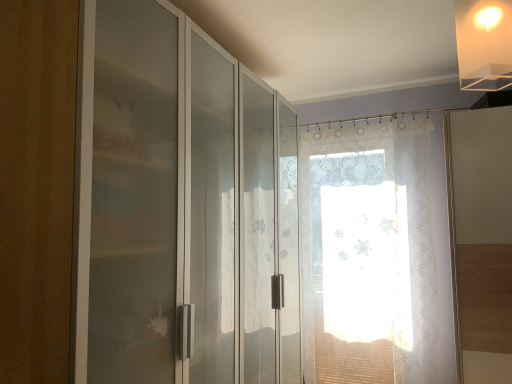
Where is `translucent floral curtain at center`? Image resolution: width=512 pixels, height=384 pixels. translucent floral curtain at center is located at coordinates (374, 254).

Locate an element on the screen. Image resolution: width=512 pixels, height=384 pixels. translucent acrylic lampshade at upper right is located at coordinates (484, 44).

The height and width of the screenshot is (384, 512). Describe the element at coordinates (484, 44) in the screenshot. I see `translucent acrylic lampshade at upper right` at that location.

Image resolution: width=512 pixels, height=384 pixels. Describe the element at coordinates (188, 209) in the screenshot. I see `frosted glass cabinet at left` at that location.

Where is `translucent floral curtain at center`? This screenshot has width=512, height=384. translucent floral curtain at center is located at coordinates (374, 254).

From a real-world perspective, is translucent acrylic lampshade at upper right on top of frosted glass cabinet at left?

Yes, from a real-world perspective, translucent acrylic lampshade at upper right is over frosted glass cabinet at left

Are translucent acrylic lampshade at upper right and frosted glass cabinet at left beside each other?

translucent acrylic lampshade at upper right is not next to frosted glass cabinet at left, and they're not touching.

Is frosted glass cabinet at left at the back of translucent acrylic lampshade at upper right?

No, translucent acrylic lampshade at upper right's orientation is not away from frosted glass cabinet at left.

Identify the location of door lying on the left of translucent acrylic lampshade at upper right. (188, 209).

Between frosted glass cabinet at left and translucent acrylic lampshade at upper right, which one has less height?

translucent acrylic lampshade at upper right is shorter.

You are a GUI agent. You are given a task and a screenshot of the screen. Output one action in this format:
    pyautogui.click(x=<x>, y=<y>)
    Task: Click on the door that appears below the translucent acrylic lampshade at upper right (from the image's perspective)
    This screenshot has width=512, height=384.
    Given the screenshot: What is the action you would take?
    pyautogui.click(x=188, y=209)

Is translucent acrylic lampshade at upper right outside of translucent floral curtain at center?

Yes.

Considering the sizes of objects translucent acrylic lampshade at upper right and translucent floral curtain at center in the image provided, who is shorter, translucent acrylic lampshade at upper right or translucent floral curtain at center?

With less height is translucent acrylic lampshade at upper right.

In the image, is translucent acrylic lampshade at upper right on the left side or the right side of translucent floral curtain at center?

Based on their positions, translucent acrylic lampshade at upper right is located to the left of translucent floral curtain at center.

Is translucent acrylic lampshade at upper right positioned in front of translucent floral curtain at center?

That is True.

Can you confirm if translucent floral curtain at center is wider than translucent acrylic lampshade at upper right?

No.

Is translucent floral curtain at center next to translucent acrylic lampshade at upper right?

They are not placed beside each other.

Which point is more forward, (369, 347) or (480, 79)?

The point (480, 79) is closer.

Considering their positions, is translucent floral curtain at center located in front of or behind translucent acrylic lampshade at upper right?

Clearly, translucent floral curtain at center is behind translucent acrylic lampshade at upper right.

Considering the sizes of objects frosted glass cabinet at left and translucent floral curtain at center in the image provided, who is thinner, frosted glass cabinet at left or translucent floral curtain at center?

translucent floral curtain at center.

Which object is closer to the camera taking this photo, frosted glass cabinet at left or translucent floral curtain at center?

frosted glass cabinet at left is closer to the camera.

Is translucent floral curtain at center surrounded by frosted glass cabinet at left?

No, translucent floral curtain at center is not a part of frosted glass cabinet at left.

How different are the orientations of frosted glass cabinet at left and translucent floral curtain at center in degrees?

The angle between the facing direction of frosted glass cabinet at left and the facing direction of translucent floral curtain at center is 86.8 degrees.

How far apart are translucent floral curtain at center and frosted glass cabinet at left?

They are 1.26 meters apart.

Consider the image. Looking at the image, does translucent floral curtain at center seem bigger or smaller compared to frosted glass cabinet at left?

Clearly, translucent floral curtain at center is smaller in size than frosted glass cabinet at left.

Where is `window located on the right of frosted glass cabinet at left`? Image resolution: width=512 pixels, height=384 pixels. window located on the right of frosted glass cabinet at left is located at coordinates (374, 254).

Is translucent floral curtain at center not inside frosted glass cabinet at left?

A: That's correct, translucent floral curtain at center is outside of frosted glass cabinet at left.

This screenshot has width=512, height=384. Find the location of `light fixture located above the frosted glass cabinet at left (from the image's perspective)`. light fixture located above the frosted glass cabinet at left (from the image's perspective) is located at coordinates (484, 44).

I want to click on door that appears below the translucent acrylic lampshade at upper right (from the image's perspective), so click(188, 209).

Looking at this image, estimate the real-world distances between objects in this image. Which object is further from frosted glass cabinet at left, translucent acrylic lampshade at upper right or translucent floral curtain at center?

Among the two, translucent floral curtain at center is located further to frosted glass cabinet at left.

From the image, which object appears to be farther from frosted glass cabinet at left, translucent floral curtain at center or translucent acrylic lampshade at upper right?

translucent floral curtain at center.

When comparing their distances from translucent floral curtain at center, does frosted glass cabinet at left or translucent acrylic lampshade at upper right seem closer?

Among the two, frosted glass cabinet at left is located nearer to translucent floral curtain at center.

From the image, which object appears to be nearer to translucent acrylic lampshade at upper right, frosted glass cabinet at left or translucent floral curtain at center?

frosted glass cabinet at left lies closer to translucent acrylic lampshade at upper right than the other object.

From the image, which object appears to be nearer to translucent floral curtain at center, translucent acrylic lampshade at upper right or frosted glass cabinet at left?

frosted glass cabinet at left lies closer to translucent floral curtain at center than the other object.

Looking at the image, which one is located closer to translucent acrylic lampshade at upper right, translucent floral curtain at center or frosted glass cabinet at left?

Among the two, frosted glass cabinet at left is located nearer to translucent acrylic lampshade at upper right.

This screenshot has width=512, height=384. What are the coordinates of `light fixture between frosted glass cabinet at left and translucent floral curtain at center in the front-back direction` in the screenshot? It's located at (484, 44).